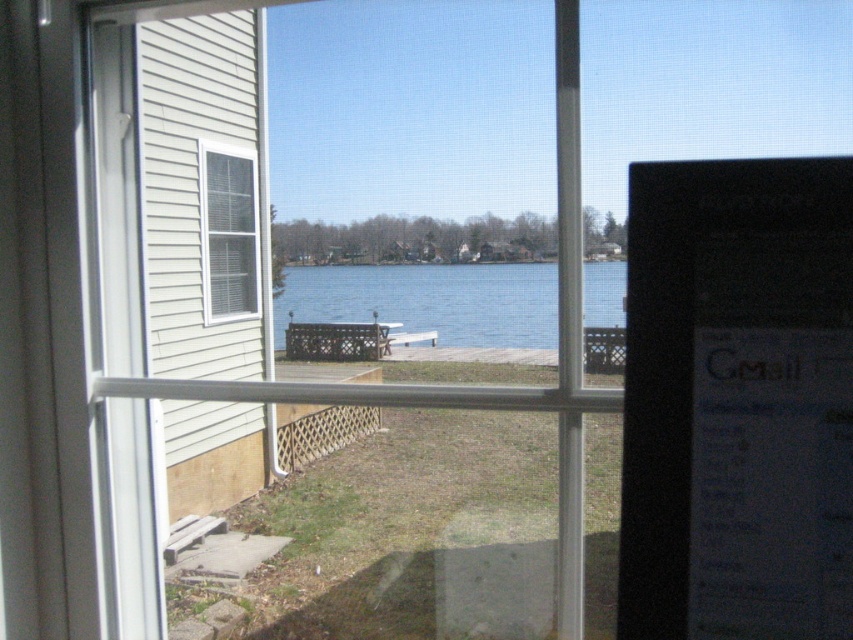
You are sitting at the picnic table on the wooden deck. You notice a black glossy monitor at right and blue water at center. Which object is closer to you?

The black glossy monitor at right is closer to you because it is in front of the blue water at center.

You are standing in the house looking through the window. There is a black glossy monitor at right. Where is the black glossy monitor located in relation to the window frame?

The black glossy monitor at right is located at point 0.628 on the x axis and 0.865 on the y axis relative to the window frame.

You are sitting at the black glossy monitor at right and want to look at the blue water at center. In which direction should you turn your head?

You should turn your head to the right because the blue water at center is to the right of the black glossy monitor at right according to the description.